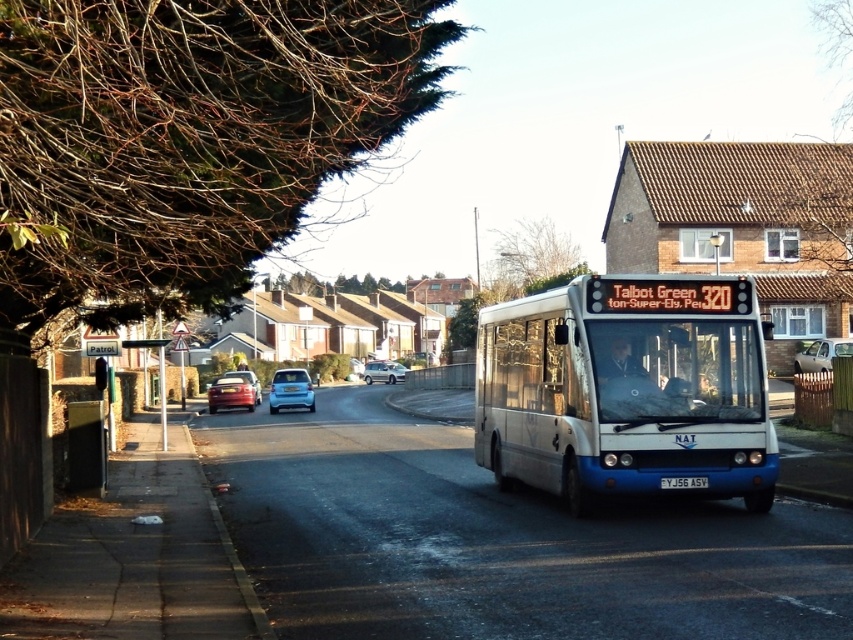
You are a delivery driver trying to park your truck, which is 2 meters wide, in the space between the light blue metallic hatchback at center and the metallic red car at center. Based on the scene, can your truck fit between them?

The light blue metallic hatchback at center might be wider than metallic red car at center, so the space between them is uncertain. It is not advisable to attempt parking the 2 meter wide truck there without more precise measurements.

Based on the coordinates provided, where is the light blue metallic hatchback at center located in the image?

The light blue metallic hatchback at center is located at the coordinates point (289, 390).